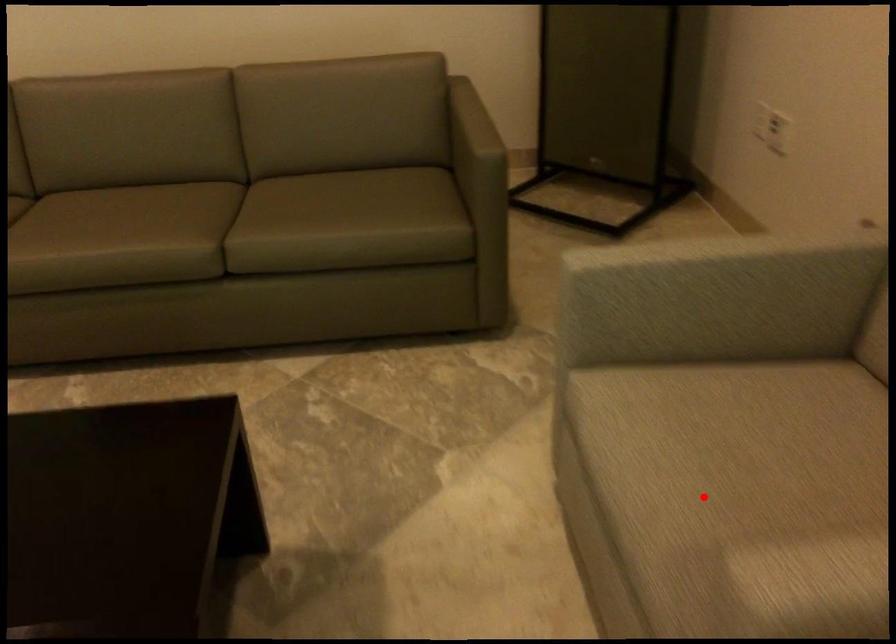
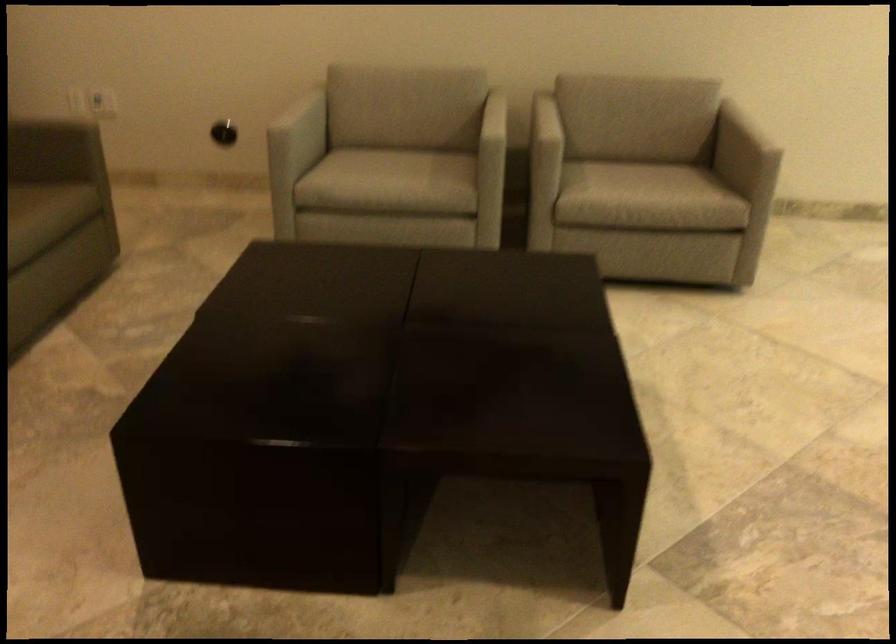
Find the pixel in the second image that matches the highlighted location in the first image.

(390, 176)